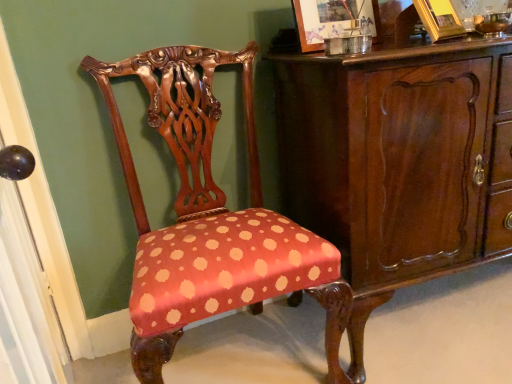
What is the approximate height of polka dot fabric chair at center?

It is 38.72 inches.

The image size is (512, 384). In order to click on mahogany wood cabinet at center in this screenshot , I will do `click(399, 162)`.

Between polka dot fabric chair at center and gold metallic picture frame at upper right, which appears as the 1th picture frame when viewed from the right, which one has more height?

polka dot fabric chair at center is taller.

Would you say polka dot fabric chair at center is to the left or to the right of gold metallic picture frame at upper right, positioned as the 2th picture frame in left-to-right order, in the picture?

In the image, polka dot fabric chair at center appears on the left side of gold metallic picture frame at upper right, positioned as the 2th picture frame in left-to-right order.

How much distance is there between polka dot fabric chair at center and gold metallic picture frame at upper right, positioned as the 2th picture frame in left-to-right order?

polka dot fabric chair at center and gold metallic picture frame at upper right, positioned as the 2th picture frame in left-to-right order, are 29.12 inches apart from each other.

Does polka dot fabric chair at center turn towards gold metallic picture frame at upper right, positioned as the 2th picture frame in left-to-right order?

No, polka dot fabric chair at center does not turn towards gold metallic picture frame at upper right, positioned as the 2th picture frame in left-to-right order.

Considering the relative sizes of mahogany wood cabinet at center and wooden picture frame at upper center, which appears as the second picture frame when viewed from the right, in the image provided, is mahogany wood cabinet at center taller than wooden picture frame at upper center, which appears as the second picture frame when viewed from the right,?

Yes, mahogany wood cabinet at center is taller than wooden picture frame at upper center, which appears as the second picture frame when viewed from the right.

From a real-world perspective, which is physically below, mahogany wood cabinet at center or wooden picture frame at upper center, positioned as the first picture frame in left-to-right order?

From a 3D spatial view, mahogany wood cabinet at center is below.

Between point (482, 77) and point (355, 14), which one is positioned behind?

The point (355, 14) is more distant.

Considering the relative positions of mahogany wood cabinet at center and wooden picture frame at upper center, positioned as the first picture frame in left-to-right order, in the image provided, is mahogany wood cabinet at center to the left of wooden picture frame at upper center, positioned as the first picture frame in left-to-right order, from the viewer's perspective?

No, mahogany wood cabinet at center is not to the left of wooden picture frame at upper center, positioned as the first picture frame in left-to-right order.

Does gold metallic picture frame at upper right, positioned as the 2th picture frame in left-to-right order, lie in front of polka dot fabric chair at center?

No, gold metallic picture frame at upper right, positioned as the 2th picture frame in left-to-right order, is behind polka dot fabric chair at center.

Is gold metallic picture frame at upper right, positioned as the 2th picture frame in left-to-right order, turned away from polka dot fabric chair at center?

That's not correct — gold metallic picture frame at upper right, positioned as the 2th picture frame in left-to-right order, is not looking away from polka dot fabric chair at center.

From the image's perspective, is gold metallic picture frame at upper right, positioned as the 2th picture frame in left-to-right order, beneath polka dot fabric chair at center?

No.

The height and width of the screenshot is (384, 512). I want to click on the chest of drawers located above the polka dot fabric chair at center (from the image's perspective), so click(x=399, y=162).

Between mahogany wood cabinet at center and polka dot fabric chair at center, which one is positioned in front?

polka dot fabric chair at center is in front.

How much distance is there between wooden picture frame at upper center, which appears as the second picture frame when viewed from the right, and mahogany wood cabinet at center?

A distance of 14.52 inches exists between wooden picture frame at upper center, which appears as the second picture frame when viewed from the right, and mahogany wood cabinet at center.

From a real-world perspective, between wooden picture frame at upper center, positioned as the first picture frame in left-to-right order, and mahogany wood cabinet at center, who is vertically higher?

In real-world perspective, wooden picture frame at upper center, positioned as the first picture frame in left-to-right order, is above.

Is point (318, 10) behind point (439, 198)?

Yes, it is.

Looking at this image, is wooden picture frame at upper center, positioned as the first picture frame in left-to-right order, turned away from mahogany wood cabinet at center?

No, wooden picture frame at upper center, positioned as the first picture frame in left-to-right order,'s orientation is not away from mahogany wood cabinet at center.

Is mahogany wood cabinet at center surrounding gold metallic picture frame at upper right, positioned as the 2th picture frame in left-to-right order?

Definitely not — gold metallic picture frame at upper right, positioned as the 2th picture frame in left-to-right order, is not inside mahogany wood cabinet at center.

Are mahogany wood cabinet at center and gold metallic picture frame at upper right, which appears as the 1th picture frame when viewed from the right, beside each other?

No, mahogany wood cabinet at center is not beside gold metallic picture frame at upper right, which appears as the 1th picture frame when viewed from the right.

Considering the relative sizes of mahogany wood cabinet at center and gold metallic picture frame at upper right, positioned as the 2th picture frame in left-to-right order, in the image provided, is mahogany wood cabinet at center shorter than gold metallic picture frame at upper right, positioned as the 2th picture frame in left-to-right order,?

No.

Is mahogany wood cabinet at center aimed at gold metallic picture frame at upper right, positioned as the 2th picture frame in left-to-right order?

No, mahogany wood cabinet at center is not facing towards gold metallic picture frame at upper right, positioned as the 2th picture frame in left-to-right order.

Is wooden picture frame at upper center, positioned as the first picture frame in left-to-right order, facing away from polka dot fabric chair at center?

wooden picture frame at upper center, positioned as the first picture frame in left-to-right order, does not have its back to polka dot fabric chair at center.

Is wooden picture frame at upper center, which appears as the second picture frame when viewed from the right, wider than polka dot fabric chair at center?

No.

Considering the sizes of wooden picture frame at upper center, positioned as the first picture frame in left-to-right order, and polka dot fabric chair at center in the image, is wooden picture frame at upper center, positioned as the first picture frame in left-to-right order, taller or shorter than polka dot fabric chair at center?

In the image, wooden picture frame at upper center, positioned as the first picture frame in left-to-right order, appears to be shorter than polka dot fabric chair at center.

Which of these two, wooden picture frame at upper center, positioned as the first picture frame in left-to-right order, or polka dot fabric chair at center, is smaller?

Smaller between the two is wooden picture frame at upper center, positioned as the first picture frame in left-to-right order.

Identify the location of chair on the left of gold metallic picture frame at upper right, which appears as the 1th picture frame when viewed from the right. point(211,218).

This screenshot has height=384, width=512. I want to click on the chest of drawers that is in front of the wooden picture frame at upper center, positioned as the first picture frame in left-to-right order, so pyautogui.click(x=399, y=162).

When comparing their distances from gold metallic picture frame at upper right, positioned as the 2th picture frame in left-to-right order, does wooden picture frame at upper center, positioned as the first picture frame in left-to-right order, or mahogany wood cabinet at center seem further?

Based on the image, mahogany wood cabinet at center appears to be further to gold metallic picture frame at upper right, positioned as the 2th picture frame in left-to-right order.

Looking at the image, which one is located closer to mahogany wood cabinet at center, polka dot fabric chair at center or gold metallic picture frame at upper right, positioned as the 2th picture frame in left-to-right order?

Based on the image, polka dot fabric chair at center appears to be nearer to mahogany wood cabinet at center.

Based on the photo, from the image, which object appears to be farther from gold metallic picture frame at upper right, which appears as the 1th picture frame when viewed from the right, polka dot fabric chair at center or mahogany wood cabinet at center?

polka dot fabric chair at center is positioned further to the anchor gold metallic picture frame at upper right, which appears as the 1th picture frame when viewed from the right.

Looking at the image, which one is located closer to gold metallic picture frame at upper right, positioned as the 2th picture frame in left-to-right order, mahogany wood cabinet at center or wooden picture frame at upper center, positioned as the first picture frame in left-to-right order?

Among the two, wooden picture frame at upper center, positioned as the first picture frame in left-to-right order, is located nearer to gold metallic picture frame at upper right, positioned as the 2th picture frame in left-to-right order.

When comparing their distances from wooden picture frame at upper center, which appears as the second picture frame when viewed from the right, does mahogany wood cabinet at center or gold metallic picture frame at upper right, positioned as the 2th picture frame in left-to-right order, seem closer?

gold metallic picture frame at upper right, positioned as the 2th picture frame in left-to-right order, is positioned closer to the anchor wooden picture frame at upper center, which appears as the second picture frame when viewed from the right.

From the image, which object appears to be farther from polka dot fabric chair at center, mahogany wood cabinet at center or gold metallic picture frame at upper right, which appears as the 1th picture frame when viewed from the right?

gold metallic picture frame at upper right, which appears as the 1th picture frame when viewed from the right.

Based on their spatial positions, is wooden picture frame at upper center, positioned as the first picture frame in left-to-right order, or gold metallic picture frame at upper right, positioned as the 2th picture frame in left-to-right order, closer to mahogany wood cabinet at center?

Based on the image, wooden picture frame at upper center, positioned as the first picture frame in left-to-right order, appears to be nearer to mahogany wood cabinet at center.

Which object lies further to the anchor point polka dot fabric chair at center, wooden picture frame at upper center, positioned as the first picture frame in left-to-right order, or gold metallic picture frame at upper right, positioned as the 2th picture frame in left-to-right order?

gold metallic picture frame at upper right, positioned as the 2th picture frame in left-to-right order, is further to polka dot fabric chair at center.

Identify the location of picture frame between gold metallic picture frame at upper right, positioned as the 2th picture frame in left-to-right order, and polka dot fabric chair at center in the up-down direction. Image resolution: width=512 pixels, height=384 pixels. (332, 20).

Where is `picture frame between gold metallic picture frame at upper right, which appears as the 1th picture frame when viewed from the right, and mahogany wood cabinet at center, in the vertical direction`? The width and height of the screenshot is (512, 384). picture frame between gold metallic picture frame at upper right, which appears as the 1th picture frame when viewed from the right, and mahogany wood cabinet at center, in the vertical direction is located at coordinates (332, 20).